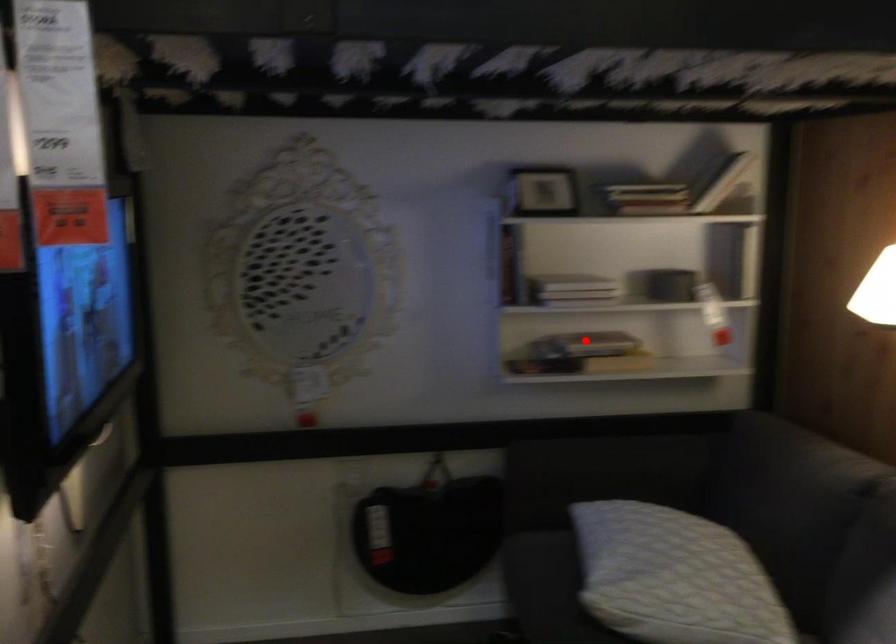
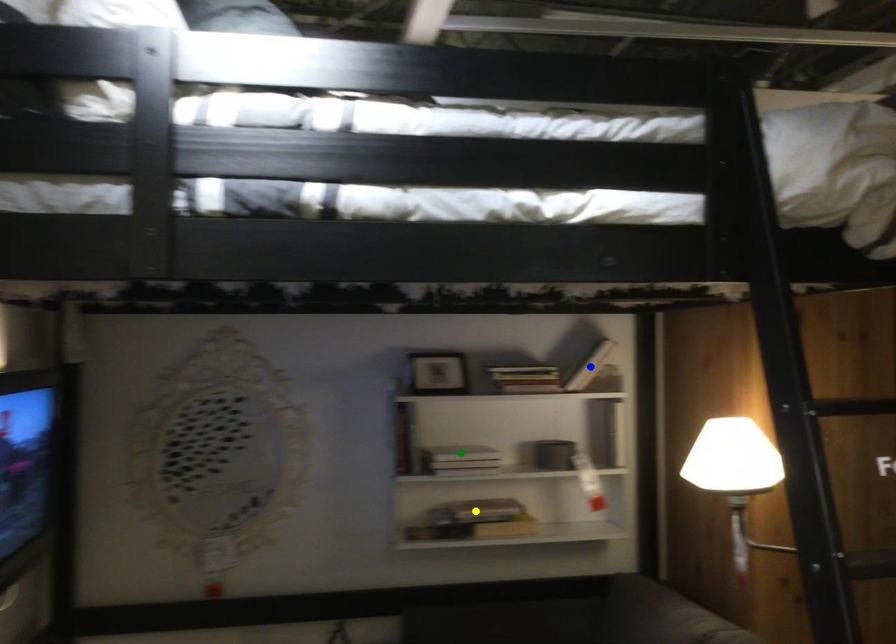
Question: I am providing you with two images of the same scene from different viewpoints. A red point is marked on the first image. You are given multiple points on the second image. Which spot in image 2 lines up with the point in image 1?

Choices:
 (A) green point
 (B) yellow point
 (C) blue point

Answer: (B)